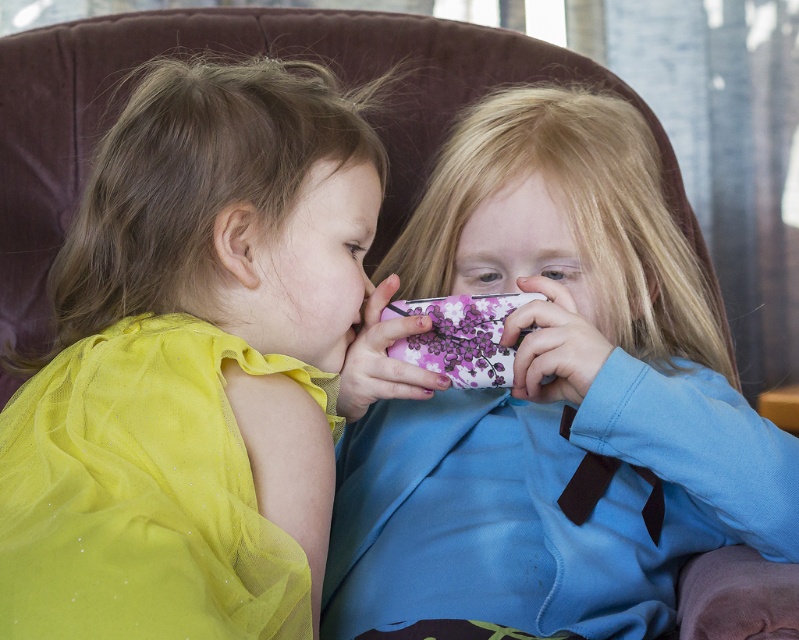
You are a fashion designer observing two yellow dresses in the image. The first is a matte yellow dress at left and the second is a shiny yellow tulle dress at left. Which dress is positioned higher on the child?

The matte yellow dress at left is positioned higher than the shiny yellow tulle dress at left, so the matte yellow dress at left is higher.

You are a photographer trying to capture a candid shot of the two children playing with the purple floral phone at center. However, the matte yellow dress at left is blocking your view. Can you move the dress to the side to get a clear shot of the phone?

The matte yellow dress at left is behind the purple floral phone at center, so it is not blocking the view. You can take the photo without moving the dress.